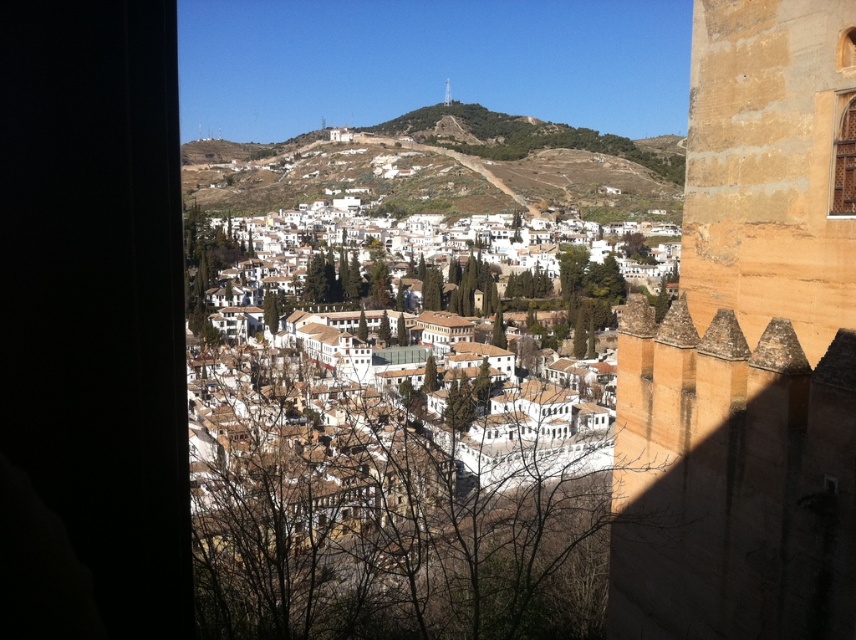
Question: Which of these objects is positioned closest to the brown earthy hillside at center?

Choices:
 (A) brown wooden window at upper right
 (B) white matte buildings at center

Answer: (B)

Question: Which of these objects is positioned closest to the brown wooden window at upper right?

Choices:
 (A) white matte buildings at center
 (B) brown earthy hillside at center

Answer: (A)

Question: Is white matte buildings at center further to camera compared to brown wooden window at upper right?

Choices:
 (A) no
 (B) yes

Answer: (B)

Question: Does brown earthy hillside at center appear under brown wooden window at upper right?

Choices:
 (A) no
 (B) yes

Answer: (A)

Question: Based on their relative distances, which object is farther from the white matte buildings at center?

Choices:
 (A) brown wooden window at upper right
 (B) brown earthy hillside at center

Answer: (B)

Question: From the image, what is the correct spatial relationship of white matte buildings at center in relation to brown wooden window at upper right?

Choices:
 (A) below
 (B) above

Answer: (A)